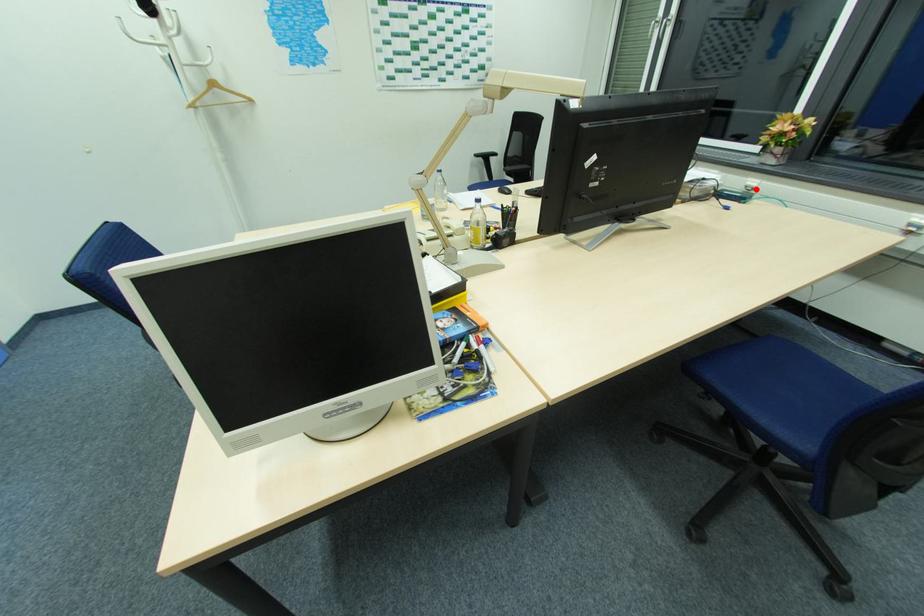
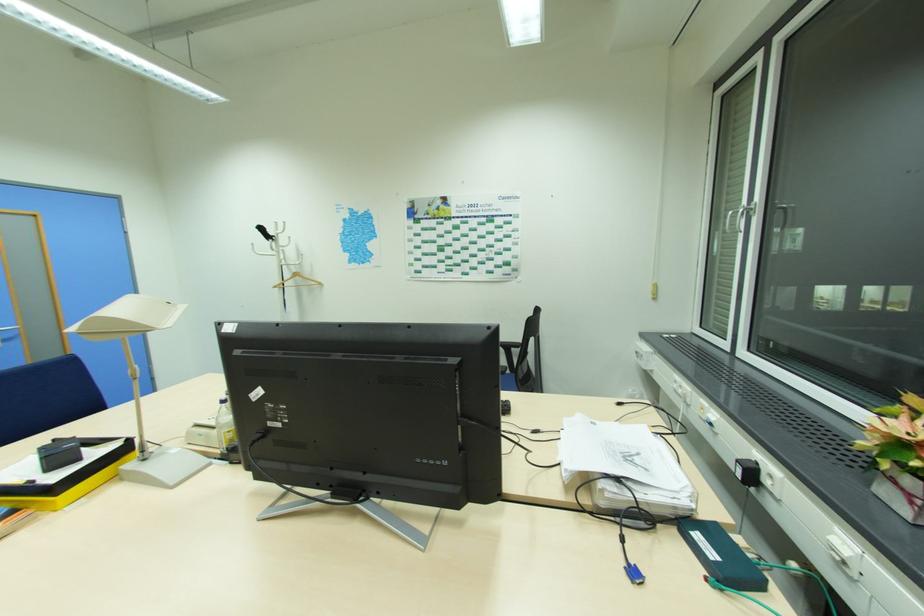
Find the pixel in the second image that matches the highlighted location in the first image.

(848, 564)